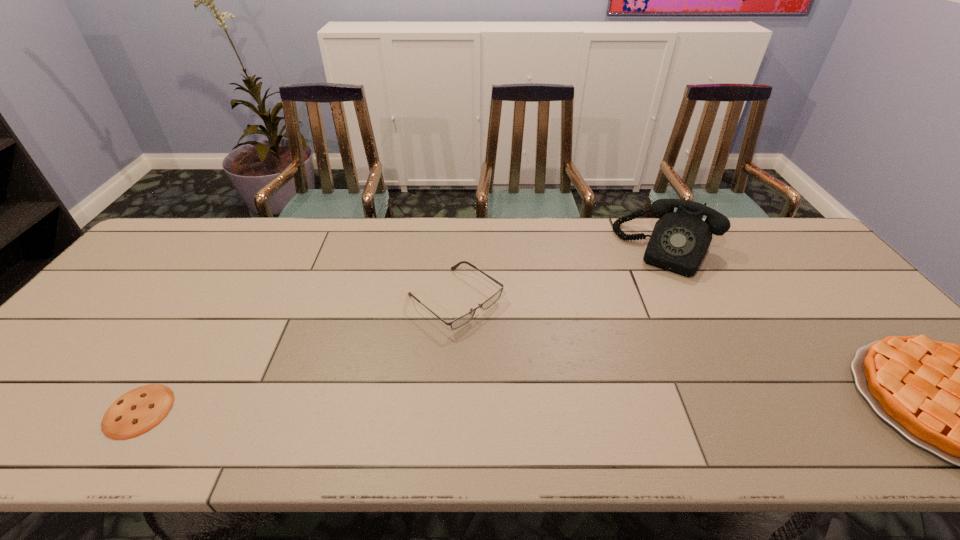
Locate an element on the screen. The image size is (960, 540). vacant space on the desktop that is between the shortest object and the rightmost object and is positioned on the front-facing side of the third tallest object is located at coordinates (598, 407).

This screenshot has width=960, height=540. In order to click on free spot on the desktop that is between the leftmost object and the second tallest object and is positioned on the dial of the third object from left to right in this screenshot , I will do `click(592, 407)`.